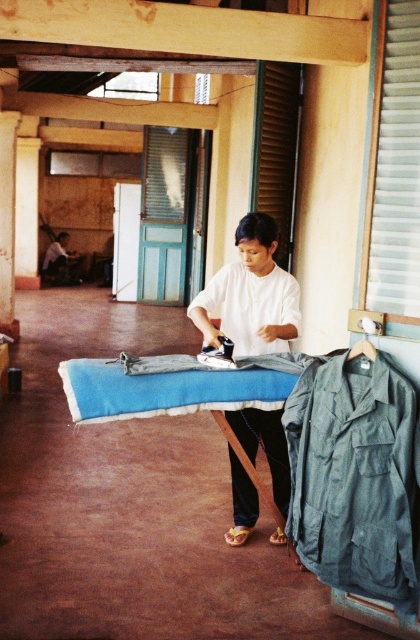
Question: Is white matte shirt at center positioned at the back of dark blue shirt at center?

Choices:
 (A) no
 (B) yes

Answer: (A)

Question: Can you confirm if white matte shirt at center is bigger than dark blue shirt at center?

Choices:
 (A) no
 (B) yes

Answer: (A)

Question: Does white matte shirt at center have a lesser width compared to dark blue shirt at center?

Choices:
 (A) no
 (B) yes

Answer: (B)

Question: Which point appears closest to the camera in this image?

Choices:
 (A) (78, 275)
 (B) (280, 288)

Answer: (B)